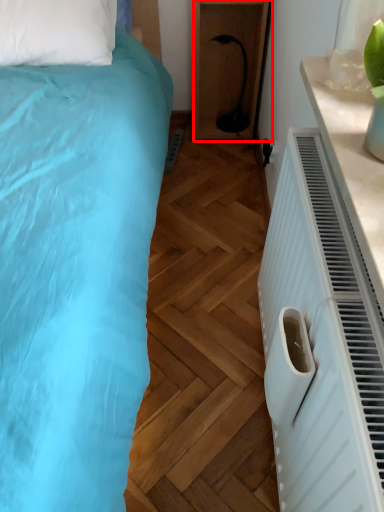
Question: From the image, what is the correct spatial relationship of furniture (annotated by the red box) in relation to electric outlet?

Choices:
 (A) left
 (B) right

Answer: (A)